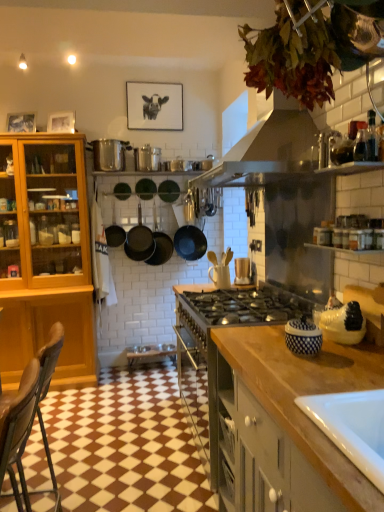
Question: Is matte black pans at center, acting as the 2th kitchen appliance starting from the right, positioned in front of matte wooden picture frame at upper left, the first picture frame when ordered from left to right?

Choices:
 (A) yes
 (B) no

Answer: (B)

Question: Can matte wooden picture frame at upper left, the first picture frame when ordered from left to right, be found inside matte black pans at center, the second kitchen appliance from the left?

Choices:
 (A) no
 (B) yes

Answer: (A)

Question: Is matte black pans at center, the second kitchen appliance from the left, in contact with matte wooden picture frame at upper left, which is counted as the 1th picture frame, starting from the front?

Choices:
 (A) no
 (B) yes

Answer: (A)

Question: Is matte black pans at center, the second kitchen appliance from the left, oriented away from matte wooden picture frame at upper left, the first picture frame when ordered from left to right?

Choices:
 (A) no
 (B) yes

Answer: (A)

Question: Is matte black pans at center, the second kitchen appliance from the left, located outside matte wooden picture frame at upper left, which is counted as the 1th picture frame, starting from the front?

Choices:
 (A) yes
 (B) no

Answer: (A)

Question: From the image's perspective, is matte black pans at center, acting as the 2th kitchen appliance starting from the right, under matte wooden picture frame at upper left, which is the 2th picture frame in back-to-front order?

Choices:
 (A) no
 (B) yes

Answer: (B)

Question: Can you confirm if blue and white ceramic jar at right, positioned as the 1th appliance in front-to-back order, is shorter than black matte frying pan at center, arranged as the first frying pan when viewed from the left?

Choices:
 (A) no
 (B) yes

Answer: (B)

Question: Is there a large distance between blue and white ceramic jar at right, marked as the 2th appliance in a right-to-left arrangement, and black matte frying pan at center, arranged as the first frying pan when viewed from the left?

Choices:
 (A) no
 (B) yes

Answer: (B)

Question: Does blue and white ceramic jar at right, positioned as the 1th appliance in front-to-back order, lie in front of black matte frying pan at center, marked as the 2th frying pan in a right-to-left arrangement?

Choices:
 (A) no
 (B) yes

Answer: (B)

Question: From the image's perspective, is blue and white ceramic jar at right, marked as the 2th appliance in a right-to-left arrangement, over black matte frying pan at center, marked as the 2th frying pan in a right-to-left arrangement?

Choices:
 (A) yes
 (B) no

Answer: (B)

Question: Would you say blue and white ceramic jar at right, which appears as the fifth appliance when viewed from the top, is outside black matte frying pan at center, marked as the 2th frying pan in a right-to-left arrangement?

Choices:
 (A) no
 (B) yes

Answer: (B)

Question: Can you confirm if blue and white ceramic jar at right, which appears as the fifth appliance when viewed from the top, is taller than black matte frying pan at center, arranged as the first frying pan when viewed from the left?

Choices:
 (A) no
 (B) yes

Answer: (A)

Question: Is metallic silver pot at upper center, placed as the 5th appliance when sorted from bottom to top, outside of matte wooden picture frame at upper left, the first picture frame when ordered from left to right?

Choices:
 (A) no
 (B) yes

Answer: (B)